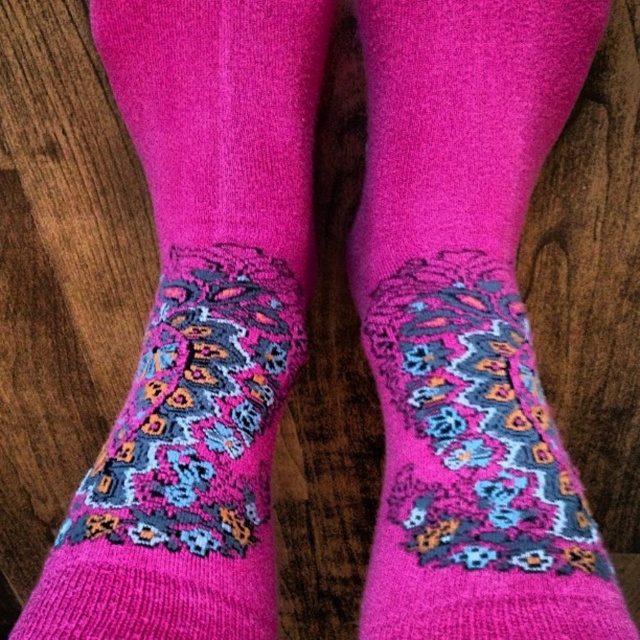
Consider the image. You are trying to decide which pair of pink knitted socks at center to wear. The other option is the knitted pink socks at center. Which one is thinner?

The pink knitted socks at center is thinner than the knitted pink socks at center.

You are arranging a display of socks on a wooden shelf. You have two pairs of pink knitted socks at center and knitted pink socks at center. If you want to place them side by side, which one should be placed to the right to match the original image?

The pink knitted socks at center should be placed to the right because in the original image, the pink knitted socks at center is positioned on the right side of knitted pink socks at center.

You are standing in a room with wooden floor and see the image. There is a point marked at coordinates [474,472]. What object is located at that point?

The point at coordinates [474,472] marks the pink knitted socks at center.